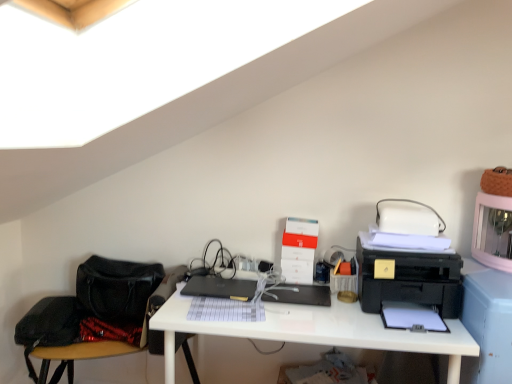
The image size is (512, 384). What are the coordinates of `free space in front of black plastic register at center` in the screenshot? It's located at (302, 321).